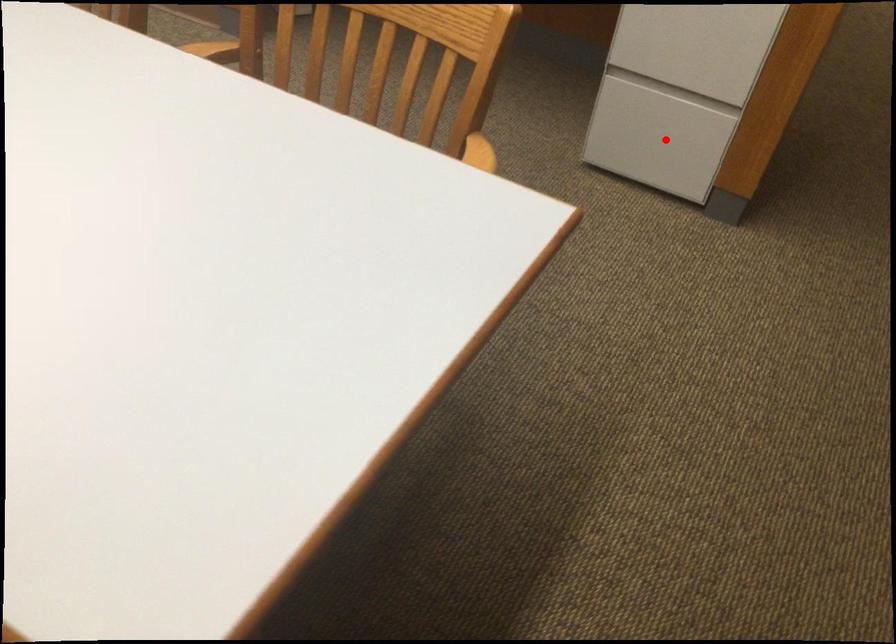
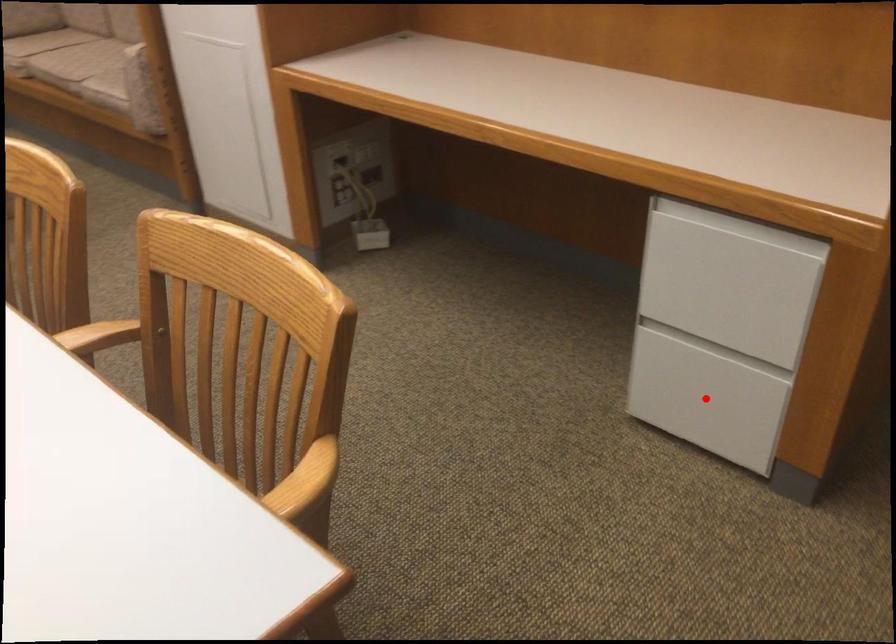
I am providing you with two images of the same scene from different viewpoints. A red point is marked on the first image and another point is marked on the second image. Is the red point in image1 aligned with the point shown in image2?

Yes